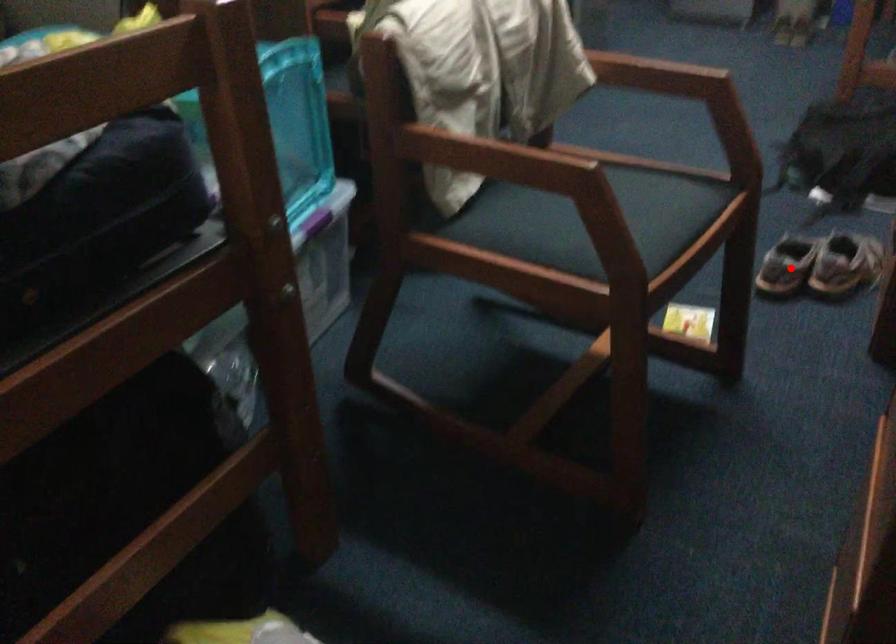
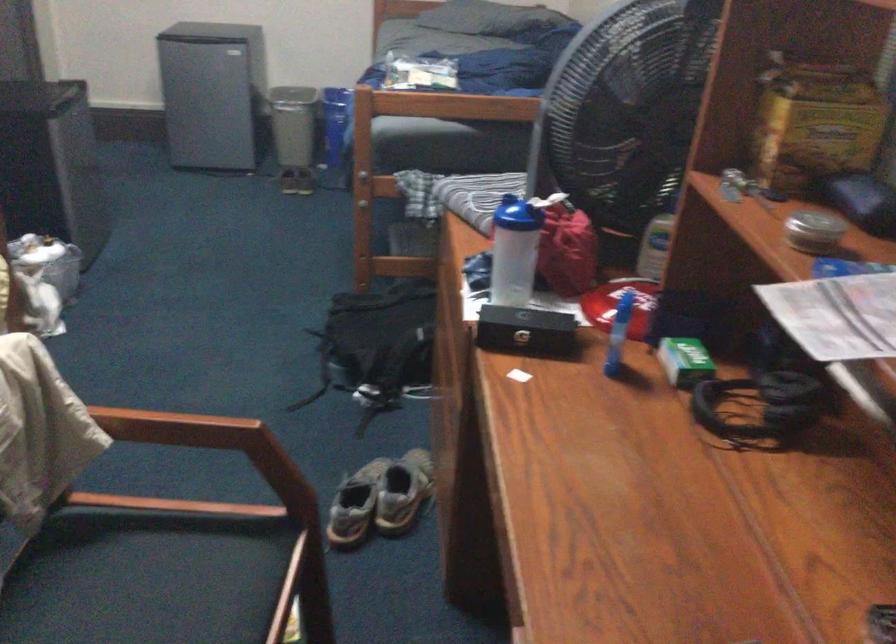
Find the pixel in the second image that matches the highlighted location in the first image.

(355, 505)